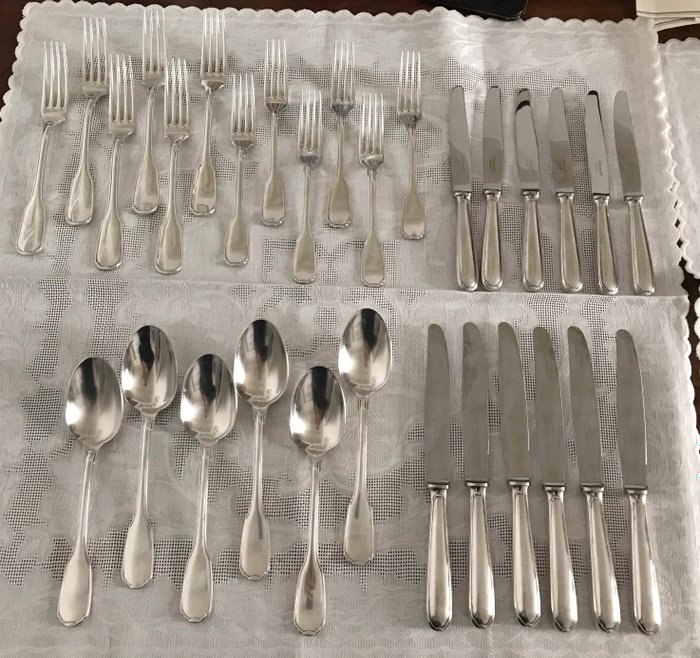
Find the location of a particular element. Image resolution: width=700 pixels, height=658 pixels. spoons is located at coordinates point(90,403), point(136,372), point(190,395), point(238,366), point(318,413), point(370,342).